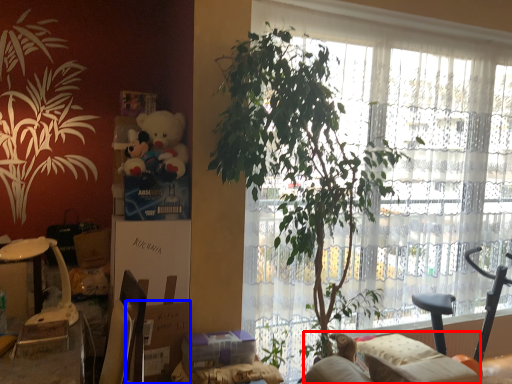
Question: Among these objects, which one is nearest to the camera, couch (highlighted by a red box) or cardboard box (highlighted by a blue box)?

Choices:
 (A) couch
 (B) cardboard box

Answer: (B)